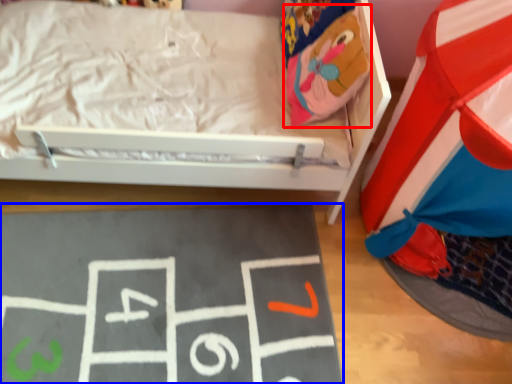
Question: Among these objects, which one is farthest to the camera, bean bag chair (highlighted by a red box) or bulletin board (highlighted by a blue box)?

Choices:
 (A) bean bag chair
 (B) bulletin board

Answer: (A)